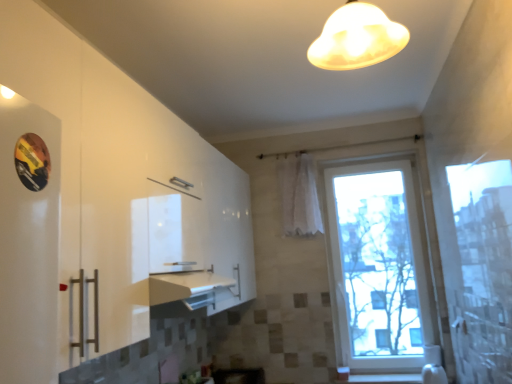
Identify the location of matte glass lampshade at upper center. The height and width of the screenshot is (384, 512). (357, 38).

This screenshot has width=512, height=384. What do you see at coordinates (377, 267) in the screenshot?
I see `transparent glass window at center` at bounding box center [377, 267].

The width and height of the screenshot is (512, 384). I want to click on matte glass lampshade at upper center, so click(x=357, y=38).

Is transparent glass window at center bigger than white sheer curtain at center?

Indeed, transparent glass window at center has a larger size compared to white sheer curtain at center.

Is transparent glass window at center far away from white sheer curtain at center?

No, transparent glass window at center is not far away from white sheer curtain at center.

Between transparent glass window at center and white sheer curtain at center, which one has smaller width?

white sheer curtain at center.

Consider the image. Is transparent glass window at center in front of or behind white sheer curtain at center in the image?

transparent glass window at center is in front of white sheer curtain at center.

Is matte glass lampshade at upper center positioned with its back to white sheer curtain at center?

matte glass lampshade at upper center is not turned away from white sheer curtain at center.

Is matte glass lampshade at upper center to the left of white sheer curtain at center from the viewer's perspective?

Yes.

Is matte glass lampshade at upper center wider or thinner than white sheer curtain at center?

In the image, matte glass lampshade at upper center appears to be wider than white sheer curtain at center.

Can you confirm if matte glass lampshade at upper center is bigger than white sheer curtain at center?

No, matte glass lampshade at upper center is not bigger than white sheer curtain at center.

From a real-world perspective, is matte glass lampshade at upper center positioned above or below transparent glass window at center?

matte glass lampshade at upper center is above transparent glass window at center.

Between matte glass lampshade at upper center and transparent glass window at center, which one has larger width?

matte glass lampshade at upper center is wider.

Is matte glass lampshade at upper center outside of transparent glass window at center?

Indeed, matte glass lampshade at upper center is completely outside transparent glass window at center.

Is matte glass lampshade at upper center in front of or behind transparent glass window at center in the image?

Clearly, matte glass lampshade at upper center is in front of transparent glass window at center.

From a real-world perspective, between white sheer curtain at center and matte glass lampshade at upper center, who is vertically higher?

matte glass lampshade at upper center.

Visually, is white sheer curtain at center positioned to the left or to the right of matte glass lampshade at upper center?

Based on their positions, white sheer curtain at center is located to the right of matte glass lampshade at upper center.

From the image's perspective, is white sheer curtain at center under matte glass lampshade at upper center?

Indeed, from the image's perspective, white sheer curtain at center is shown beneath matte glass lampshade at upper center.

Who is taller, transparent glass window at center or matte glass lampshade at upper center?

transparent glass window at center is taller.

From the image's perspective, which is above, transparent glass window at center or matte glass lampshade at upper center?

matte glass lampshade at upper center appears higher in the image.

Could you tell me if transparent glass window at center is facing matte glass lampshade at upper center?

Yes, transparent glass window at center is facing matte glass lampshade at upper center.

What's the angular difference between transparent glass window at center and matte glass lampshade at upper center's facing directions?

transparent glass window at center and matte glass lampshade at upper center are facing 84.3 degrees away from each other.

Based on the photo, considering the relative sizes of white sheer curtain at center and transparent glass window at center in the image provided, is white sheer curtain at center thinner than transparent glass window at center?

Yes.

Image resolution: width=512 pixels, height=384 pixels. In order to click on window that appears on the right of white sheer curtain at center in this screenshot , I will do `click(377, 267)`.

Considering the positions of objects white sheer curtain at center and transparent glass window at center in the image provided, who is more to the left, white sheer curtain at center or transparent glass window at center?

white sheer curtain at center.

Is white sheer curtain at center next to transparent glass window at center and touching it?

They are not placed beside each other.

In order to click on window in front of the white sheer curtain at center in this screenshot , I will do `click(377, 267)`.

At what (x,y) coordinates should I click in order to perform the action: click on curtain behind the matte glass lampshade at upper center. Please return your answer as a coordinate pair (x, y). Looking at the image, I should click on (298, 196).

Based on their spatial positions, is transparent glass window at center or matte glass lampshade at upper center closer to white sheer curtain at center?

Among the two, transparent glass window at center is located nearer to white sheer curtain at center.

Looking at the image, which one is located closer to transparent glass window at center, white sheer curtain at center or matte glass lampshade at upper center?

Based on the image, white sheer curtain at center appears to be nearer to transparent glass window at center.

From the image, which object appears to be farther from transparent glass window at center, matte glass lampshade at upper center or white sheer curtain at center?

Based on the image, matte glass lampshade at upper center appears to be further to transparent glass window at center.

From the image, which object appears to be nearer to white sheer curtain at center, matte glass lampshade at upper center or transparent glass window at center?

transparent glass window at center is positioned closer to the anchor white sheer curtain at center.

Looking at the image, which one is located closer to matte glass lampshade at upper center, transparent glass window at center or white sheer curtain at center?

Based on the image, white sheer curtain at center appears to be nearer to matte glass lampshade at upper center.

Based on their spatial positions, is white sheer curtain at center or transparent glass window at center further from matte glass lampshade at upper center?

Among the two, transparent glass window at center is located further to matte glass lampshade at upper center.

Locate an element on the screen. The image size is (512, 384). window between matte glass lampshade at upper center and white sheer curtain at center in the front-back direction is located at coordinates (377, 267).